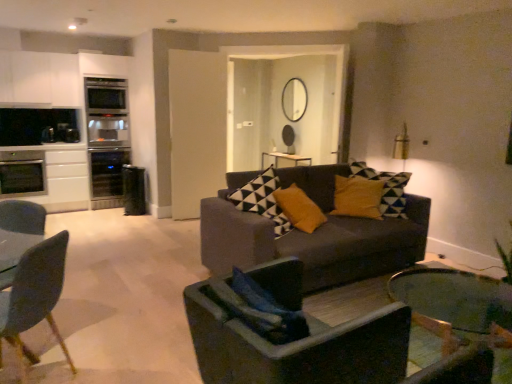
You are a GUI agent. You are given a task and a screenshot of the screen. Output one action in this format:
    pyautogui.click(x=<x>, y=<y>)
    Task: Click on the free point behind matte gray chair at left, the first chair positioned from the left
    The height and width of the screenshot is (384, 512).
    Given the screenshot: What is the action you would take?
    pyautogui.click(x=84, y=348)